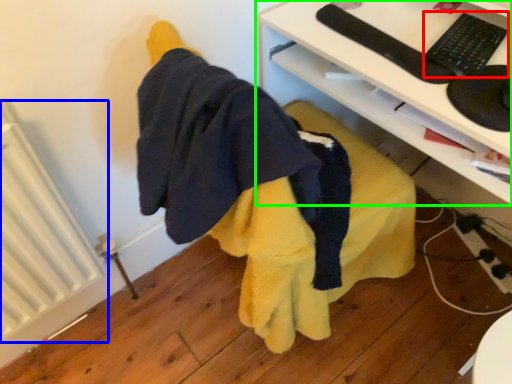
Question: Which is farther away from keyboard (highlighted by a red box)? radiator (highlighted by a blue box) or desk (highlighted by a green box)?

Choices:
 (A) radiator
 (B) desk

Answer: (A)